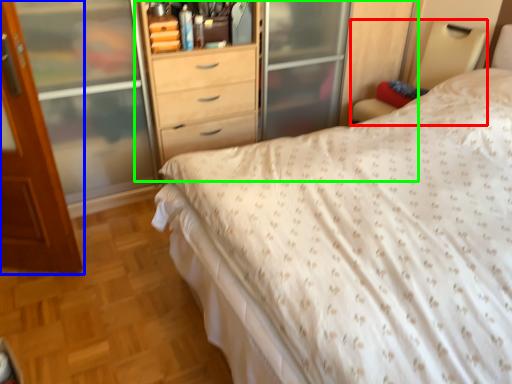
Question: Considering the real-world distances, which object is farthest from bed frame (highlighted by a red box)? door (highlighted by a blue box) or dresser (highlighted by a green box)?

Choices:
 (A) door
 (B) dresser

Answer: (A)